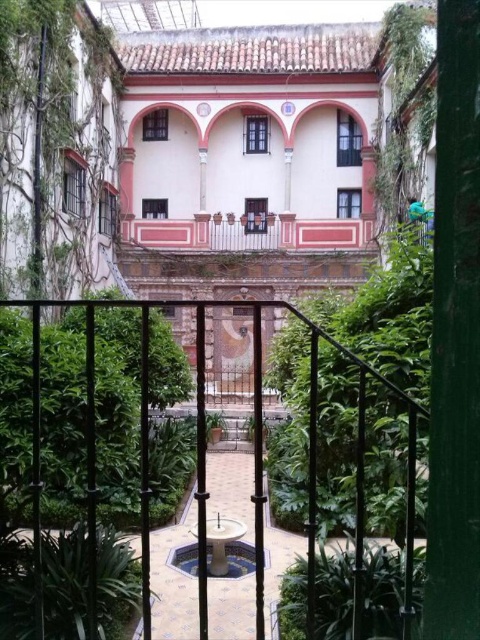
You are standing in the courtyard and see two points marked in the scene. The first point is at coordinates point [304,317] and the second point is at point [375,608]. Which point is closer to you?

Point [304,317] is in front of point [375,608], so it is closer to you.

You are standing in the courtyard and want to reach the black metal fence at center from the green leafy plant at lower left. Which direction should you move towards?

To reach the black metal fence at center from the green leafy plant at lower left, you should move towards the right since the black metal fence at center is positioned to the right of the green leafy plant at lower left.